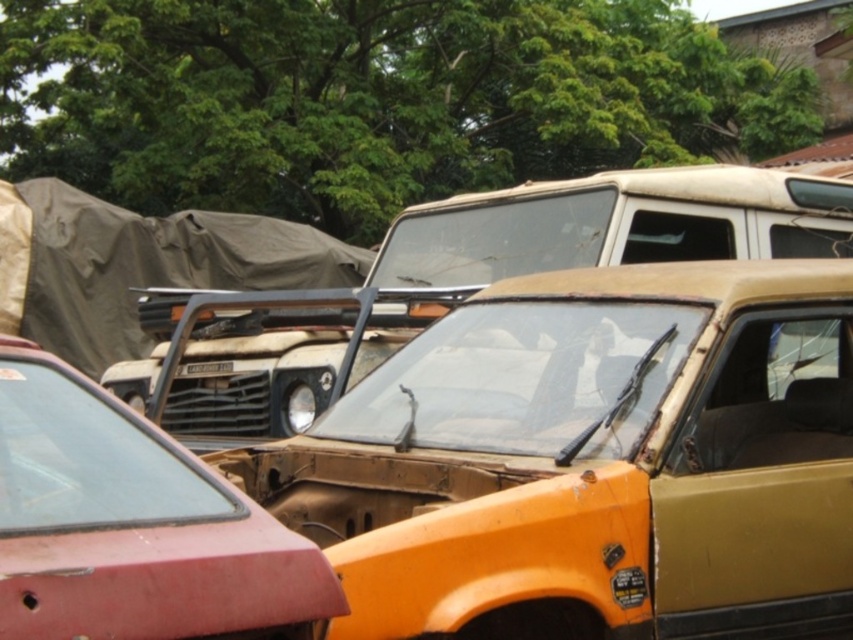
Which is above, rusty metal pickup truck at center or matte red car at lower left?

Positioned higher is rusty metal pickup truck at center.

Describe the element at coordinates (616, 224) in the screenshot. I see `rusty metal pickup truck at center` at that location.

The width and height of the screenshot is (853, 640). I want to click on rusty metal pickup truck at center, so click(616, 224).